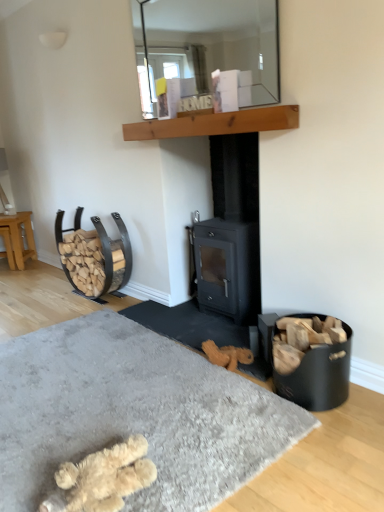
Where is `black matte wood burning stove at center`? black matte wood burning stove at center is located at coordinates (231, 232).

This screenshot has width=384, height=512. What do you see at coordinates (133, 413) in the screenshot?
I see `fluffy beige slippers at lower center` at bounding box center [133, 413].

What do you see at coordinates (103, 478) in the screenshot? This screenshot has height=512, width=384. I see `fuzzy beige slippers at lower left` at bounding box center [103, 478].

Locate an element on the screen. black matte wood burning stove at center is located at coordinates (231, 232).

Does clear glass mirror at upper center contain light brown wooden stool at left?

Actually, light brown wooden stool at left is outside clear glass mirror at upper center.

Which is farther from the camera, (144, 34) or (13, 244)?

The point (13, 244) is behind.

Is clear glass mirror at upper center bigger or smaller than light brown wooden stool at left?

clear glass mirror at upper center is smaller than light brown wooden stool at left.

Where is `mirror in front of the light brown wooden stool at left`? mirror in front of the light brown wooden stool at left is located at coordinates (206, 54).

From a real-world perspective, between wooden at upper center and fuzzy beige slippers at lower left, who is vertically higher?

From a 3D spatial view, wooden at upper center is above.

Does wooden at upper center have a larger size compared to fuzzy beige slippers at lower left?

Incorrect, wooden at upper center is not larger than fuzzy beige slippers at lower left.

Is fuzzy beige slippers at lower left at the back of wooden at upper center?

wooden at upper center is not turned away from fuzzy beige slippers at lower left.

At what (x,y) coordinates should I click in order to perform the action: click on mirror in front of the wooden at upper center. Please return your answer as a coordinate pair (x, y). Image resolution: width=384 pixels, height=512 pixels. Looking at the image, I should click on (206, 54).

From a real-world perspective, who is located lower, clear glass mirror at upper center or wooden at upper center?

wooden at upper center is physically lower.

Considering the sizes of objects clear glass mirror at upper center and wooden at upper center in the image provided, who is wider, clear glass mirror at upper center or wooden at upper center?

With larger width is wooden at upper center.

Is black matte wood burning stove at center next to light brown wooden stool at left and touching it?

No, black matte wood burning stove at center is not in contact with light brown wooden stool at left.

Does black matte wood burning stove at center have a greater height compared to light brown wooden stool at left?

Indeed, black matte wood burning stove at center has a greater height compared to light brown wooden stool at left.

Considering the positions of objects black matte wood burning stove at center and light brown wooden stool at left in the image provided, who is in front, black matte wood burning stove at center or light brown wooden stool at left?

black matte wood burning stove at center is in front.

From a real-world perspective, is black matte wood burning stove at center positioned over light brown wooden stool at left based on gravity?

Yes.

How many degrees apart are the facing directions of fuzzy beige slippers at lower left and light brown wooden stool at left?

134 degrees separate the facing orientations of fuzzy beige slippers at lower left and light brown wooden stool at left.

In terms of size, does fuzzy beige slippers at lower left appear bigger or smaller than light brown wooden stool at left?

Considering their sizes, fuzzy beige slippers at lower left takes up less space than light brown wooden stool at left.

Is fuzzy beige slippers at lower left facing towards light brown wooden stool at left?

No, fuzzy beige slippers at lower left does not turn towards light brown wooden stool at left.

Does fuzzy beige slippers at lower left have a lesser height compared to light brown wooden stool at left?

Yes, fuzzy beige slippers at lower left is shorter than light brown wooden stool at left.

Does fuzzy beige slippers at lower left have a lesser height compared to black matte wood burning stove at center?

Indeed, fuzzy beige slippers at lower left has a lesser height compared to black matte wood burning stove at center.

Is fuzzy beige slippers at lower left looking in the opposite direction of black matte wood burning stove at center?

No, black matte wood burning stove at center is not at the back of fuzzy beige slippers at lower left.

From the image's perspective, between fuzzy beige slippers at lower left and black matte wood burning stove at center, who is located below?

fuzzy beige slippers at lower left appears lower in the image.

Can you confirm if fluffy beige slippers at lower center is thinner than black matte wood burning stove at center?

Incorrect, the width of fluffy beige slippers at lower center is not less than that of black matte wood burning stove at center.

Does fluffy beige slippers at lower center appear on the left side of black matte wood burning stove at center?

Yes.

Are fluffy beige slippers at lower center and black matte wood burning stove at center making contact?

fluffy beige slippers at lower center is not next to black matte wood burning stove at center, and they're not touching.

Could you measure the distance between fluffy beige slippers at lower center and black matte wood burning stove at center?

fluffy beige slippers at lower center and black matte wood burning stove at center are 32.98 inches apart from each other.

At what (x,y) coordinates should I click in order to perform the action: click on furniture located on the left of clear glass mirror at upper center. Please return your answer as a coordinate pair (x, y). Looking at the image, I should click on (17, 239).

The image size is (384, 512). I want to click on animal that is under the wooden at upper center (from a real-world perspective), so click(103, 478).

When comparing their distances from fuzzy beige slippers at lower left, does wooden at upper center or fluffy beige slippers at lower center seem closer?

fluffy beige slippers at lower center is closer to fuzzy beige slippers at lower left.

When comparing their distances from black matte wood burning stove at center, does fluffy beige slippers at lower center or fuzzy beige slippers at lower left seem closer?

Based on the image, fluffy beige slippers at lower center appears to be nearer to black matte wood burning stove at center.

Considering their positions, is black matte wood burning stove at center positioned closer to fuzzy beige slippers at lower left than light brown wooden stool at left?

black matte wood burning stove at center is positioned closer to the anchor fuzzy beige slippers at lower left.

Consider the image. When comparing their distances from fluffy beige slippers at lower center, does wooden at upper center or fuzzy beige slippers at lower left seem closer?

The object closer to fluffy beige slippers at lower center is fuzzy beige slippers at lower left.

Considering their positions, is fuzzy beige slippers at lower left positioned further to fluffy beige slippers at lower center than black matte wood burning stove at center?

black matte wood burning stove at center lies further to fluffy beige slippers at lower center than the other object.

Looking at the image, which one is located further to light brown wooden stool at left, wooden at upper center or fluffy beige slippers at lower center?

fluffy beige slippers at lower center is further to light brown wooden stool at left.

From the image, which object appears to be farther from fuzzy beige slippers at lower left, clear glass mirror at upper center or fluffy beige slippers at lower center?

clear glass mirror at upper center is positioned further to the anchor fuzzy beige slippers at lower left.

From the image, which object appears to be nearer to black matte wood burning stove at center, light brown wooden stool at left or fluffy beige slippers at lower center?

fluffy beige slippers at lower center is positioned closer to the anchor black matte wood burning stove at center.

I want to click on animal between fluffy beige slippers at lower center and light brown wooden stool at left from front to back, so click(103, 478).

You are a GUI agent. You are given a task and a screenshot of the screen. Output one action in this format:
    pyautogui.click(x=<x>, y=<y>)
    Task: Click on the wood burning stove between wooden at upper center and fuzzy beige slippers at lower left in the vertical direction
    This screenshot has width=384, height=512.
    Given the screenshot: What is the action you would take?
    pyautogui.click(x=231, y=232)

Identify the location of mirror between fuzzy beige slippers at lower left and light brown wooden stool at left in the front-back direction. The height and width of the screenshot is (512, 384). (206, 54).

I want to click on shelf between fluffy beige slippers at lower center and light brown wooden stool at left from front to back, so click(215, 123).